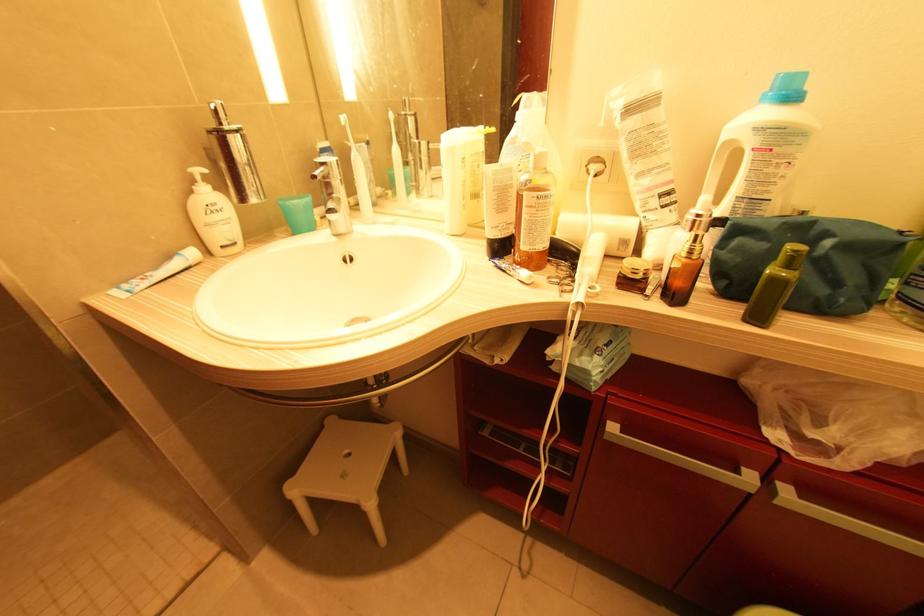
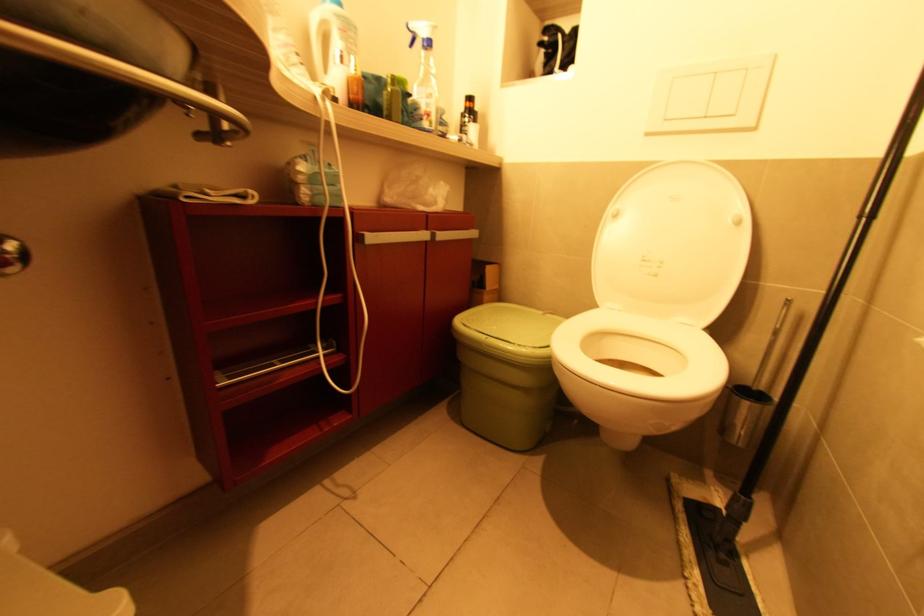
Question: The camera is either moving clockwise (left) or counter-clockwise (right) around the object. The first image is from the beginning of the video and the second image is from the end. Is the camera moving left or right when shooting the video?

Choices:
 (A) Left
 (B) Right

Answer: (A)